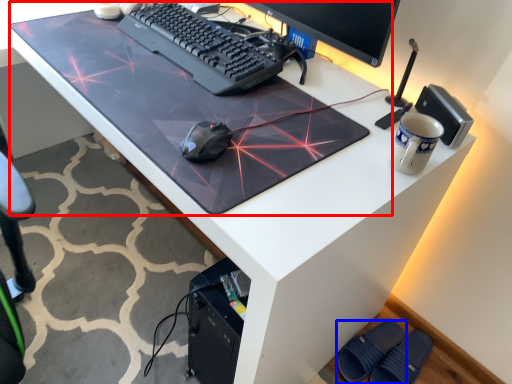
Question: Which object appears closest to the camera in this image, table top (highlighted by a red box) or footwear (highlighted by a blue box)?

Choices:
 (A) table top
 (B) footwear

Answer: (A)